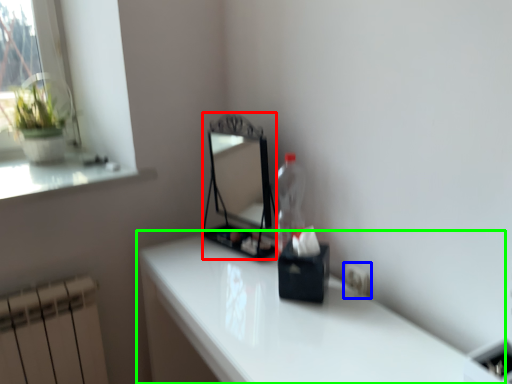
Question: Considering the real-world distances, which object is closest to mirror (highlighted by a red box)? electric outlet (highlighted by a blue box) or table (highlighted by a green box).

Choices:
 (A) electric outlet
 (B) table

Answer: (B)